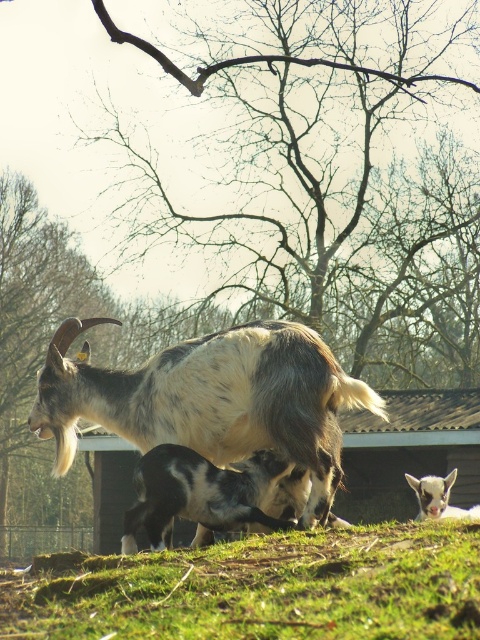
Is green grassy at lower center below white and brown fur goat at center?

Yes, green grassy at lower center is below white and brown fur goat at center.

Is green grassy at lower center further to camera compared to white and brown fur goat at center?

No, it is not.

You are a GUI agent. You are given a task and a screenshot of the screen. Output one action in this format:
    pyautogui.click(x=<x>, y=<y>)
    Task: Click on the green grassy at lower center
    Image resolution: width=480 pixels, height=640 pixels.
    Given the screenshot: What is the action you would take?
    pyautogui.click(x=263, y=588)

Does point (72, 339) lie in front of point (259, 502)?

No, it is not.

Which of these two, white and brown fur goat at center or black and white fur at center, stands shorter?

Standing shorter between the two is black and white fur at center.

Is point (247, 362) closer to camera compared to point (157, 509)?

That is False.

Locate an element on the screen. The image size is (480, 640). white and brown fur goat at center is located at coordinates (211, 400).

Who is positioned more to the left, black and white fur at center or white woolen goat at lower right?

From the viewer's perspective, black and white fur at center appears more on the left side.

Who is lower down, black and white fur at center or white woolen goat at lower right?

black and white fur at center is below.

Locate an element on the screen. black and white fur at center is located at coordinates (200, 493).